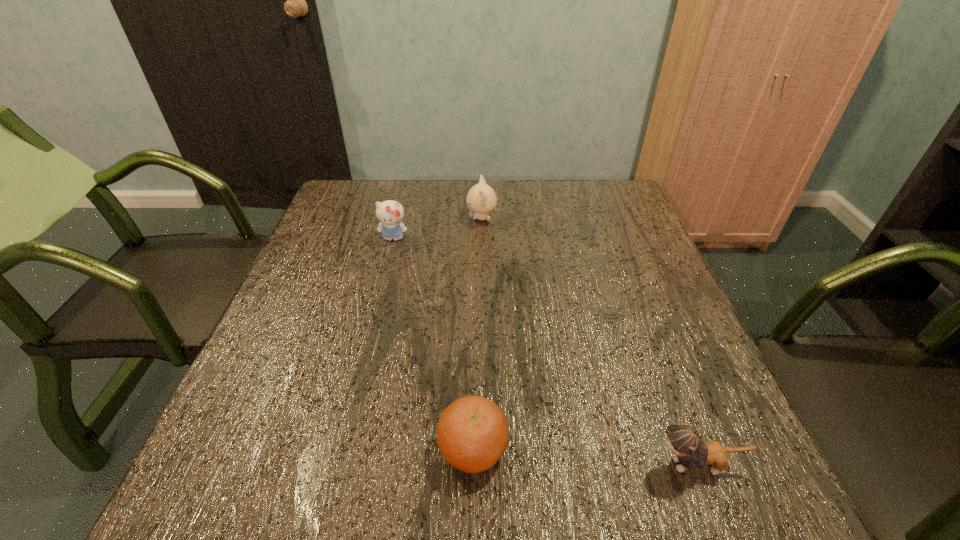
Where is `free space located on the face of the farthest kitten`? The image size is (960, 540). free space located on the face of the farthest kitten is located at coordinates (396, 218).

The height and width of the screenshot is (540, 960). What are the coordinates of `blank space located on the front-facing side of the rightmost object` in the screenshot? It's located at (473, 465).

Locate an element on the screen. vacant space located 0.370m on the front-facing side of the rightmost object is located at coordinates (424, 465).

The height and width of the screenshot is (540, 960). In order to click on free space located on the front-facing side of the rightmost object in this screenshot , I will do (x=424, y=465).

At what (x,y) coordinates should I click in order to perform the action: click on vacant space situated 0.090m on the right of the clementine. Please return your answer as a coordinate pair (x, y). The width and height of the screenshot is (960, 540). Looking at the image, I should click on (562, 448).

Find the location of a particular element. object at the far edge is located at coordinates (481, 199).

Find the location of a particular element. Image resolution: width=960 pixels, height=540 pixels. kitten that is at the near edge is located at coordinates (685, 441).

Locate an element on the screen. This screenshot has height=540, width=960. clementine located in the near edge section of the desktop is located at coordinates (472, 434).

Where is `object located in the right edge section of the desktop`? object located in the right edge section of the desktop is located at coordinates (685, 441).

Identify the location of object that is at the near right corner. (685, 441).